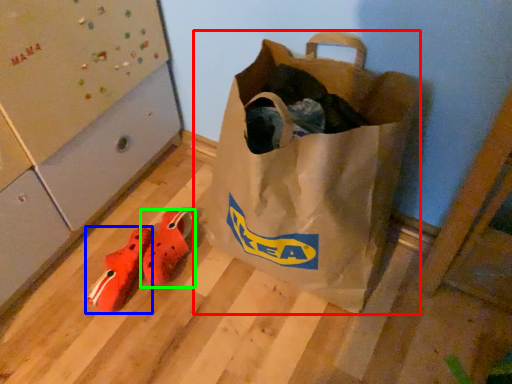
Question: Which object is the farthest from luggage and bags (highlighted by a red box)? Choose among these: shoe (highlighted by a blue box) or footwear (highlighted by a green box).

Choices:
 (A) shoe
 (B) footwear

Answer: (A)